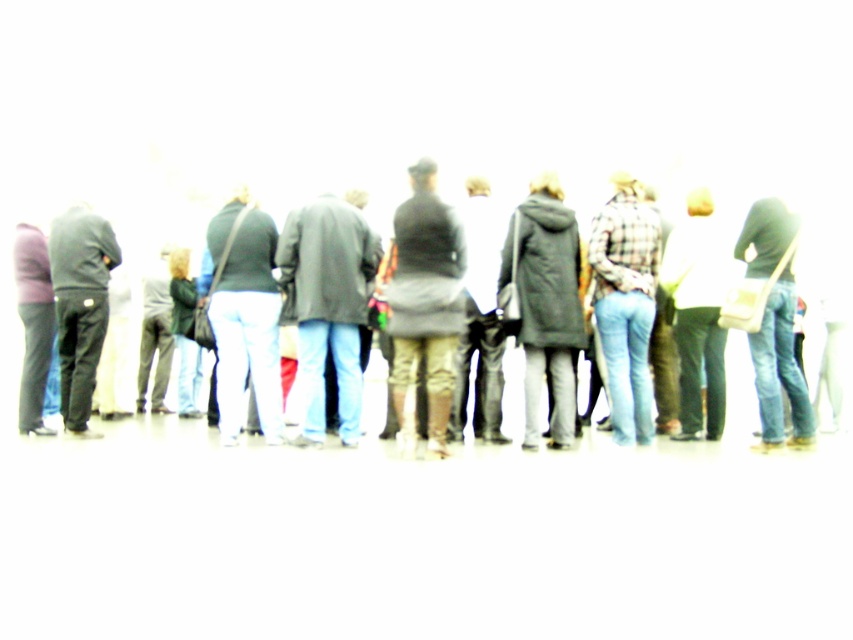
You are a photographer trying to adjust the lighting for a group photo. You notice the matte black coat at center and the plaid fabric shirt at center in the image. Which clothing item is positioned higher on the person, and why might this affect the lighting adjustments?

The matte black coat at center is above the plaid fabric shirt at center. This positioning means the coat may cast shadows on the shirt, requiring adjustments to ensure even lighting across both items.